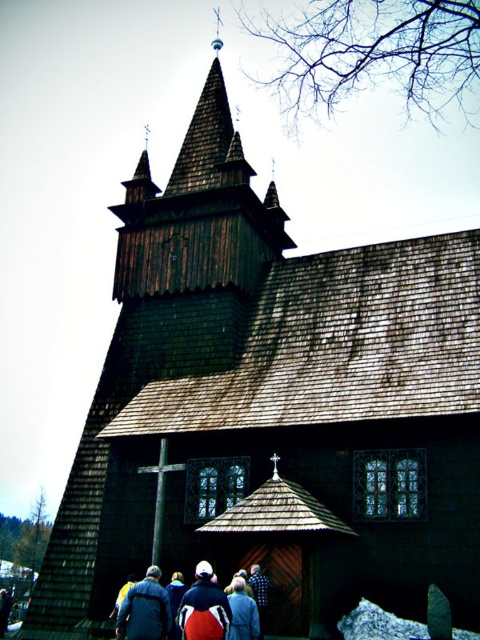
Does point (249, 612) come closer to viewer compared to point (145, 602)?

Yes, point (249, 612) is in front of point (145, 602).

Which is in front, point (157, 625) or point (118, 612)?

Point (157, 625) is more forward.

You are a GUI agent. You are given a task and a screenshot of the screen. Output one action in this format:
    pyautogui.click(x=<x>, y=<y>)
    Task: Click on the dark blue jacket at lower center
    This screenshot has width=480, height=640.
    Given the screenshot: What is the action you would take?
    pyautogui.click(x=216, y=609)

Between dark blue jacket at lower center and blue fabric jacket at lower center, which one has more height?

With more height is dark blue jacket at lower center.

How much distance is there between dark blue jacket at lower center and blue fabric jacket at lower center?

The distance of dark blue jacket at lower center from blue fabric jacket at lower center is 4.77 feet.

Find the location of a particular element. This screenshot has height=640, width=480. dark blue jacket at lower center is located at coordinates pos(216,609).

Is red jacket at center further to camera compared to blue fabric jacket at lower center?

That is False.

Does red jacket at center appear under blue fabric jacket at lower center?

Yes, red jacket at center is below blue fabric jacket at lower center.

Where is `red jacket at center`? red jacket at center is located at coordinates (204, 608).